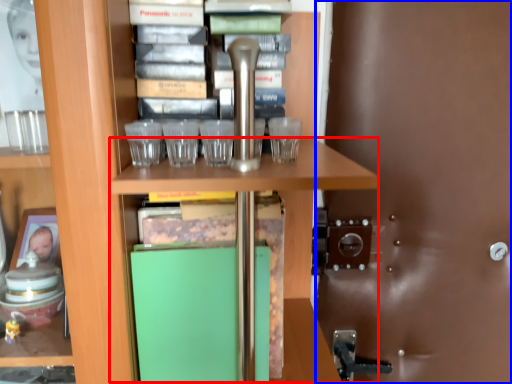
Question: Which of the following is the farthest to the observer, table (highlighted by a red box) or glass door (highlighted by a blue box)?

Choices:
 (A) table
 (B) glass door

Answer: (B)